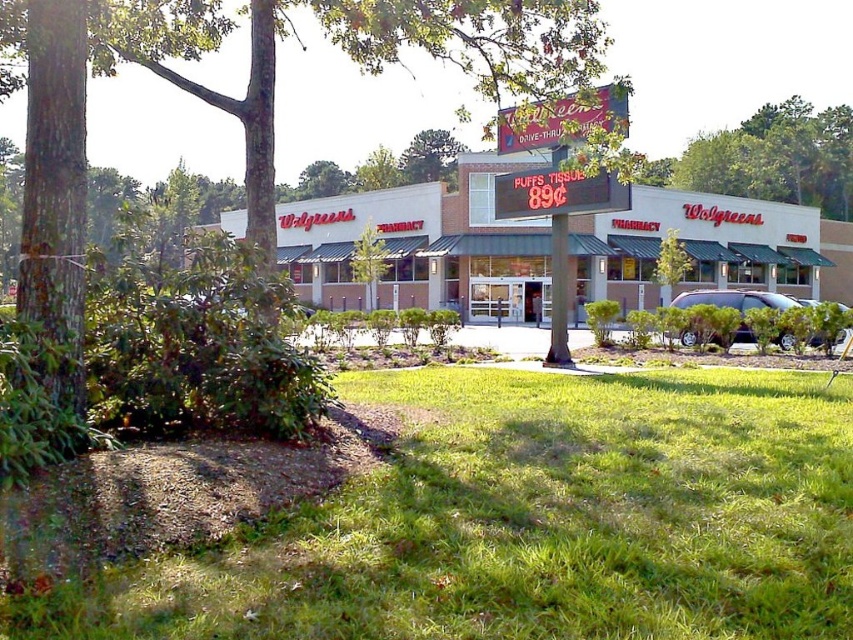
You are standing at the entrance of the Walgreens pharmacy and want to find the green grass at lower center. According to the coordinates provided, where exactly is the green grass located?

The green grass at lower center is located at point (x=531, y=522).

You are standing in front of the Walgreens pharmacy and want to take a photo of the green leafy tree at center. Which direction should you face to capture it in your camera?

The green leafy tree at center is located at the center of the image, so you should face towards the center to capture it in your camera.